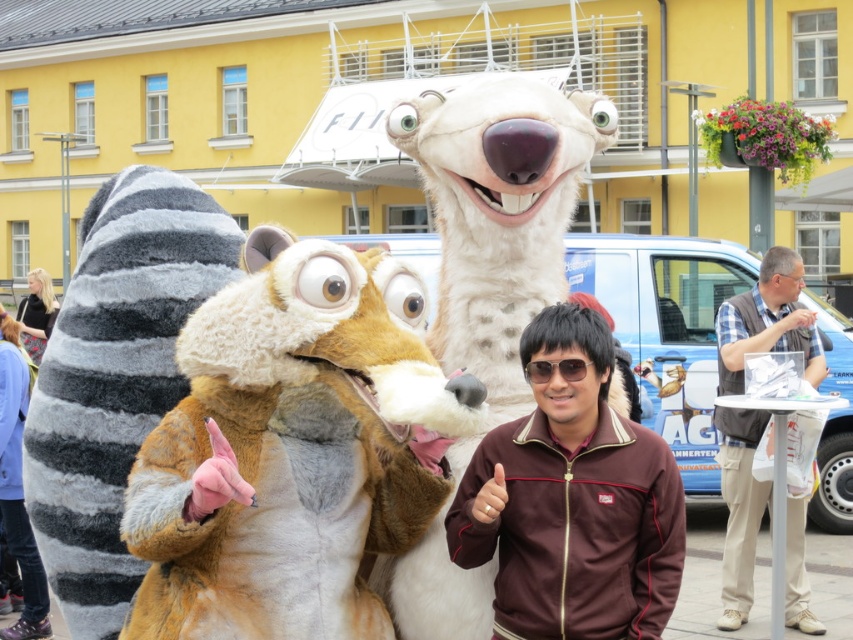
Based on the photo, is white plush bear at center further to the viewer compared to sunglasses at center?

Yes, it is behind sunglasses at center.

Looking at this image, between white plush bear at center and sunglasses at center, which one appears on the left side from the viewer's perspective?

From the viewer's perspective, white plush bear at center appears more on the left side.

Between point (466, 202) and point (540, 365), which one is positioned behind?

The point (466, 202) is more distant.

Identify the location of white plush bear at center. (498, 212).

Which is below, white plush bear at center or beige fabric vest at right?

Positioned lower is beige fabric vest at right.

Who is taller, white plush bear at center or beige fabric vest at right?

With more height is beige fabric vest at right.

Does point (509, 356) come farther from viewer compared to point (810, 339)?

No, it is not.

I want to click on white plush bear at center, so click(x=498, y=212).

Can you confirm if fuzzy brown fox at center is bigger than beige fabric vest at right?

No.

Which is more to the right, fuzzy brown fox at center or beige fabric vest at right?

Positioned to the right is beige fabric vest at right.

Is point (331, 387) closer to camera compared to point (799, 262)?

That is True.

Where is `fuzzy brown fox at center`? The width and height of the screenshot is (853, 640). fuzzy brown fox at center is located at coordinates [289, 454].